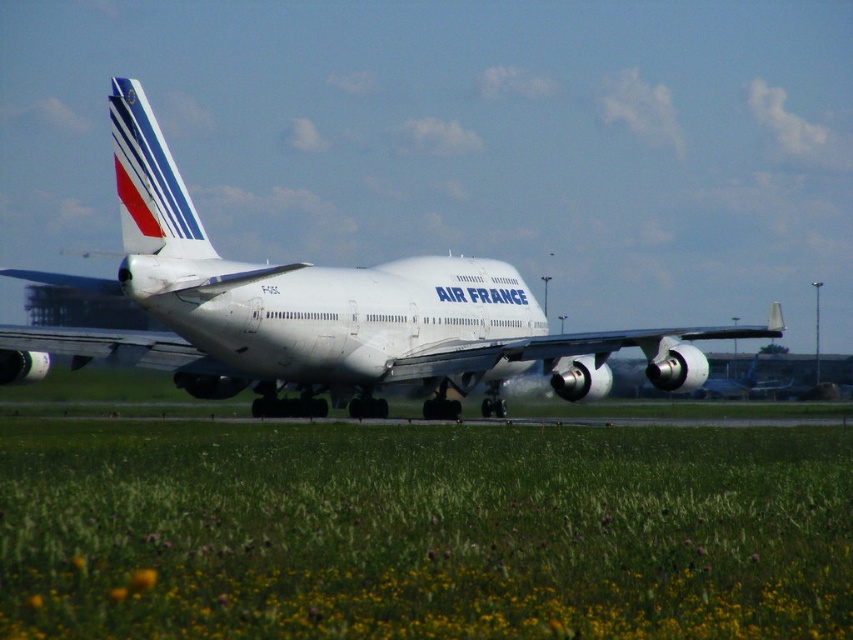
You are standing on the runway and see the Air France Boeing 747 aircraft. There are two points marked on the plane, point 1 at coordinates point (328, 444) and point 2 at coordinates point (346, 323). Which point is closer to you?

Point (328, 444) is closer to the viewer than point (346, 323).

Based on the scene description, where is the green grass at center located in terms of its 2D coordinates?

The green grass at center is located at the 2D coordinates of point (424, 531).